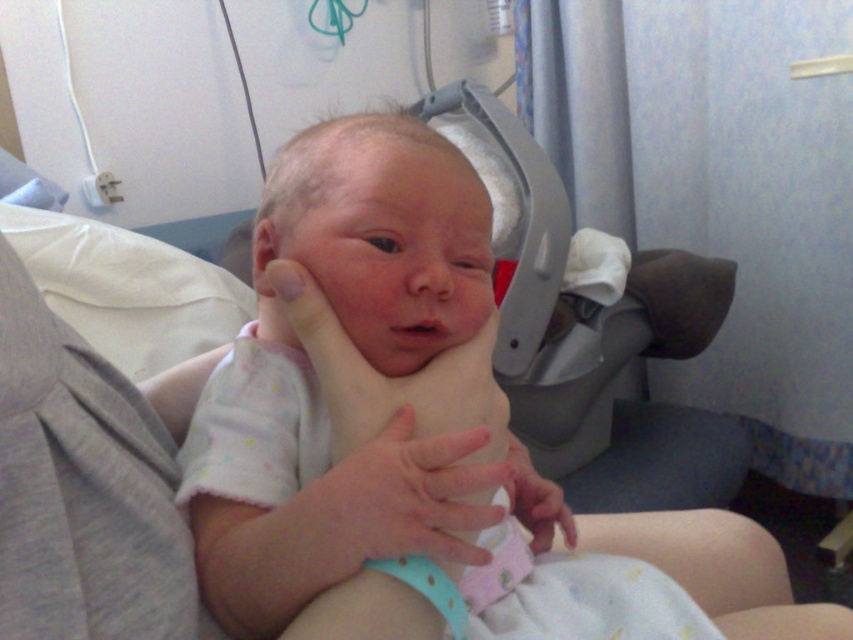
Between white cotton newborn at center and pink fabric at center, which one appears on the left side from the viewer's perspective?

Positioned to the left is pink fabric at center.

I want to click on white cotton newborn at center, so click(x=310, y=371).

Image resolution: width=853 pixels, height=640 pixels. What are the coordinates of `white cotton newborn at center` in the screenshot? It's located at (310, 371).

Is pink fabric hand at center to the left of pink fabric at center from the viewer's perspective?

Correct, you'll find pink fabric hand at center to the left of pink fabric at center.

Is point (346, 468) farther from camera compared to point (572, 518)?

That is False.

Does point (463, 544) come farther from viewer compared to point (538, 518)?

No.

Identify the location of pink fabric hand at center. (405, 497).

Which is behind, point (660, 540) or point (345, 467)?

Positioned behind is point (660, 540).

Based on the photo, can you confirm if white cotton newborn at center is positioned below pink fabric hand at center?

Indeed, white cotton newborn at center is positioned under pink fabric hand at center.

Does point (358, 486) come closer to viewer compared to point (463, 468)?

That is True.

In order to click on white cotton newborn at center in this screenshot , I will do `click(310, 371)`.